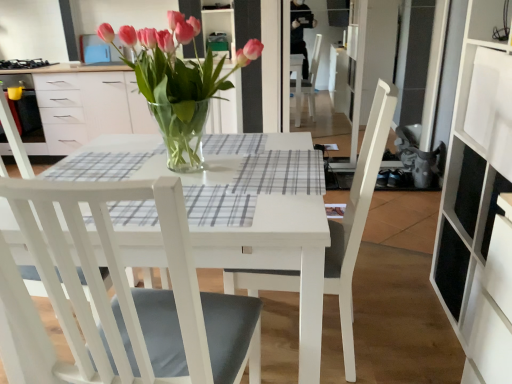
You are a GUI agent. You are given a task and a screenshot of the screen. Output one action in this format:
    pyautogui.click(x=<x>, y=<y>)
    Task: Click on the free space above white matte chair at center, placed as the first chair when sorted from left to right (from a real-world perspective)
    This screenshot has height=384, width=512.
    Given the screenshot: What is the action you would take?
    pyautogui.click(x=201, y=164)